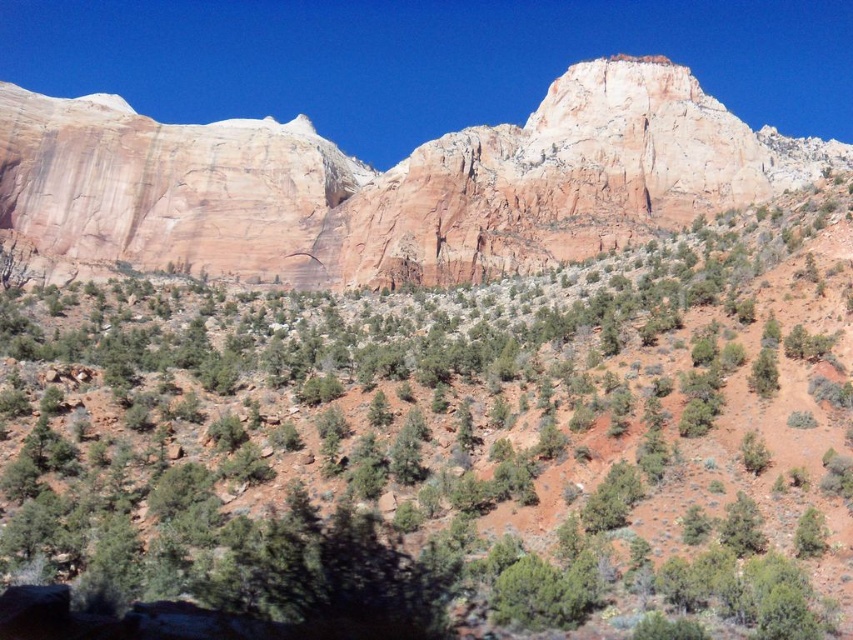
Question: Which point appears farthest from the camera in this image?

Choices:
 (A) (524, 348)
 (B) (154, 188)

Answer: (B)

Question: Is green shrub at center wider than rustic sandstone mountain at upper center?

Choices:
 (A) no
 (B) yes

Answer: (A)

Question: Among these points, which one is farthest from the camera?

Choices:
 (A) (590, 141)
 (B) (247, 349)

Answer: (A)

Question: Does green shrub at center have a larger size compared to rustic sandstone mountain at upper center?

Choices:
 (A) no
 (B) yes

Answer: (A)

Question: Does green shrub at center appear over rustic sandstone mountain at upper center?

Choices:
 (A) no
 (B) yes

Answer: (A)